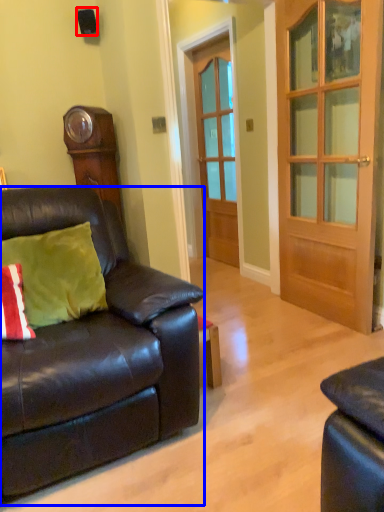
Question: Which object appears closest to the camera in this image, loudspeaker (highlighted by a red box) or studio couch (highlighted by a blue box)?

Choices:
 (A) loudspeaker
 (B) studio couch

Answer: (B)